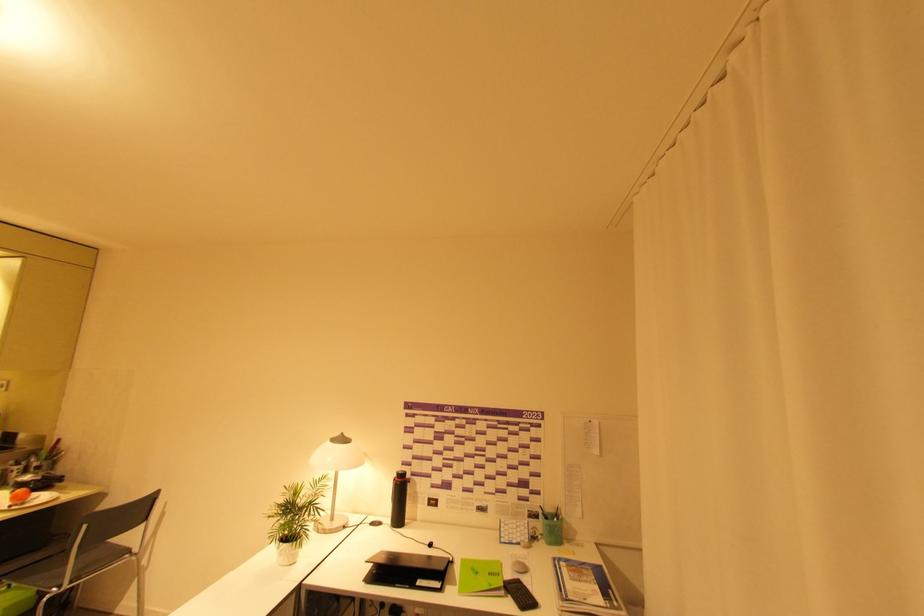
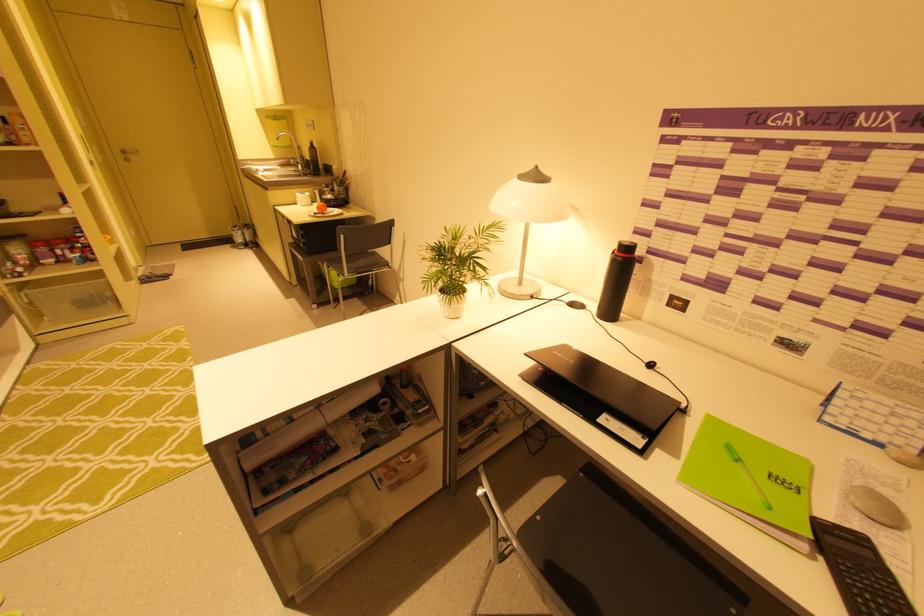
Locate, in the second image, the point that corresponds to (x=417, y=586) in the first image.

(596, 419)